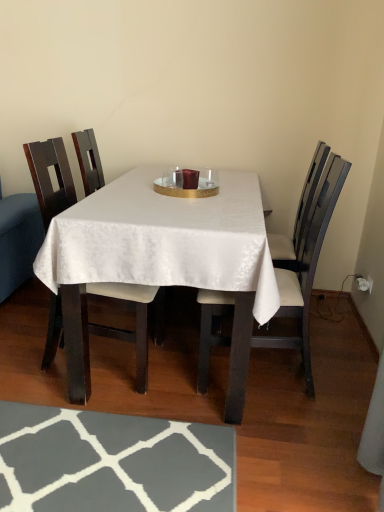
Locate an element on the screen. The height and width of the screenshot is (512, 384). free location in front of matte wood chair at left, which is the 2th chair from right to left is located at coordinates (80, 445).